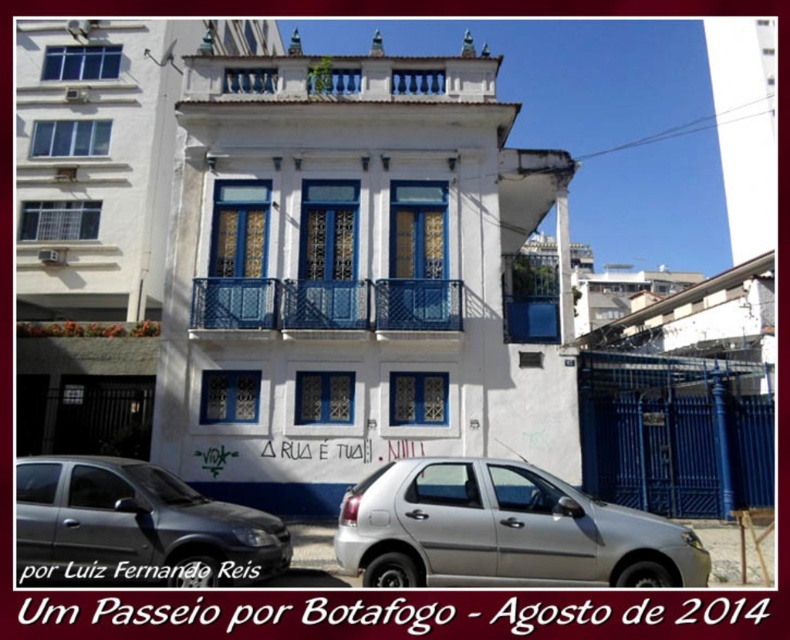
Is silver metallic hatchback at center wider than blue metal railing at center?

Incorrect, silver metallic hatchback at center's width does not surpass blue metal railing at center's.

Is point (547, 545) closer to camera compared to point (352, 298)?

Yes, point (547, 545) is closer to viewer.

Identify the location of silver metallic hatchback at center. (503, 531).

Does point (51, 540) come farther from viewer compared to point (378, 289)?

No, it is not.

Can you confirm if satin silver car at lower left is shorter than blue metal railing at center?

No.

Between point (88, 477) and point (316, 289), which one is positioned behind?

Positioned behind is point (316, 289).

Find the location of a particular element. The image size is (790, 640). satin silver car at lower left is located at coordinates (137, 525).

Is point (424, 481) positioned after point (62, 500)?

Yes, point (424, 481) is farther from viewer.

Does silver metallic hatchback at center appear over satin silver car at lower left?

Incorrect, silver metallic hatchback at center is not positioned above satin silver car at lower left.

Is point (585, 579) more distant than point (104, 548)?

That is False.

Identify the location of silver metallic hatchback at center. This screenshot has width=790, height=640. (503, 531).